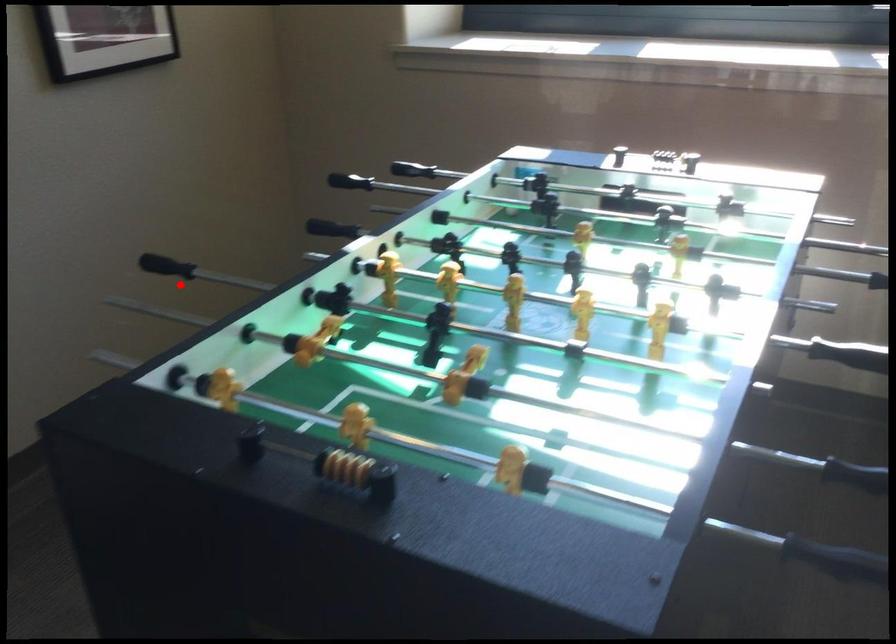
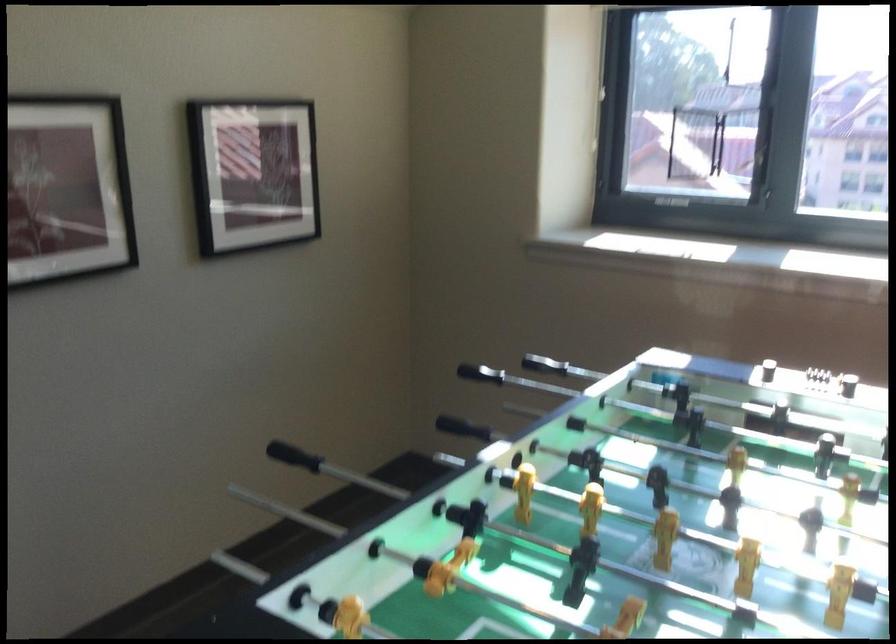
In the second image, find the point that corresponds to the highlighted location in the first image.

(294, 456)